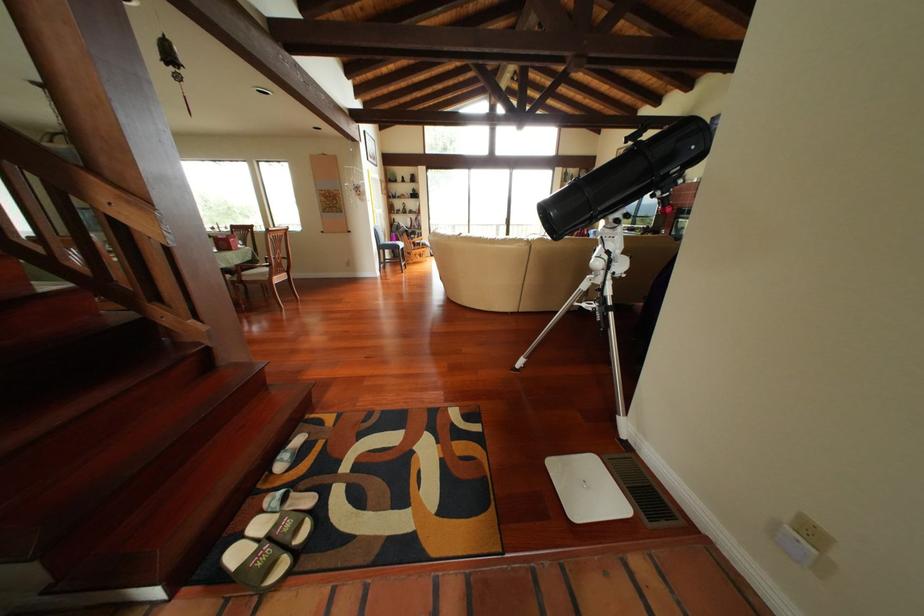
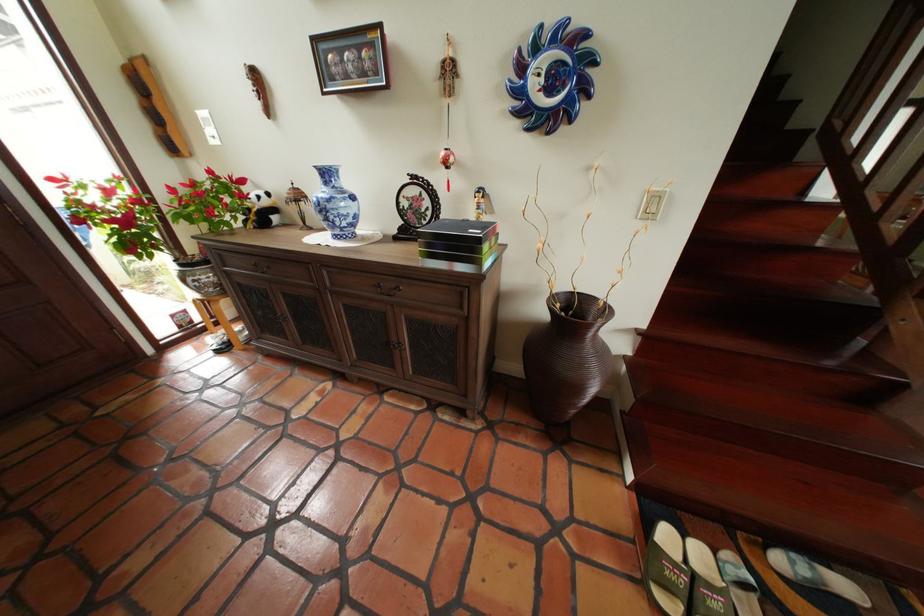
In the second image, find the point that corresponds to pixel 295 461 in the first image.

(806, 564)